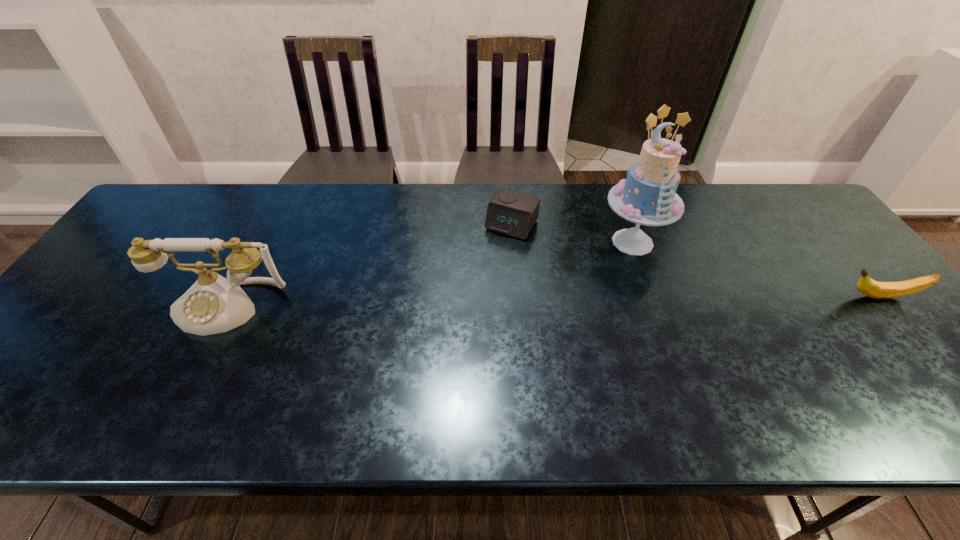
Locate an element on the screen. The width and height of the screenshot is (960, 540). blank area at the near edge is located at coordinates pos(643,372).

In the image, there is a desktop. Where is `free space at the right edge`? free space at the right edge is located at coordinates tap(847, 267).

In the image, there is a desktop. Where is `free space at the far left corner`? This screenshot has height=540, width=960. free space at the far left corner is located at coordinates (209, 197).

In the image, there is a desktop. What are the coordinates of `vacant region at the near left corner` in the screenshot? It's located at (75, 382).

In the image, there is a desktop. Where is `free space at the near right corner`? Image resolution: width=960 pixels, height=540 pixels. free space at the near right corner is located at coordinates (899, 380).

Where is `vacant point located between the alarm clock and the rightmost object`? This screenshot has width=960, height=540. vacant point located between the alarm clock and the rightmost object is located at coordinates (696, 261).

The image size is (960, 540). In order to click on vacant space in between the third object from left to right and the third shortest object in this screenshot , I will do `click(429, 274)`.

You are a GUI agent. You are given a task and a screenshot of the screen. Output one action in this format:
    pyautogui.click(x=<x>, y=<y>)
    Task: Click on the empty space that is in between the banana and the second object from right to left
    
    Given the screenshot: What is the action you would take?
    pyautogui.click(x=756, y=269)

Find the location of a particular element. free spot between the third object from right to left and the third object from left to right is located at coordinates (572, 233).

The image size is (960, 540). What are the coordinates of `free point between the alarm clock and the banana` in the screenshot? It's located at (696, 261).